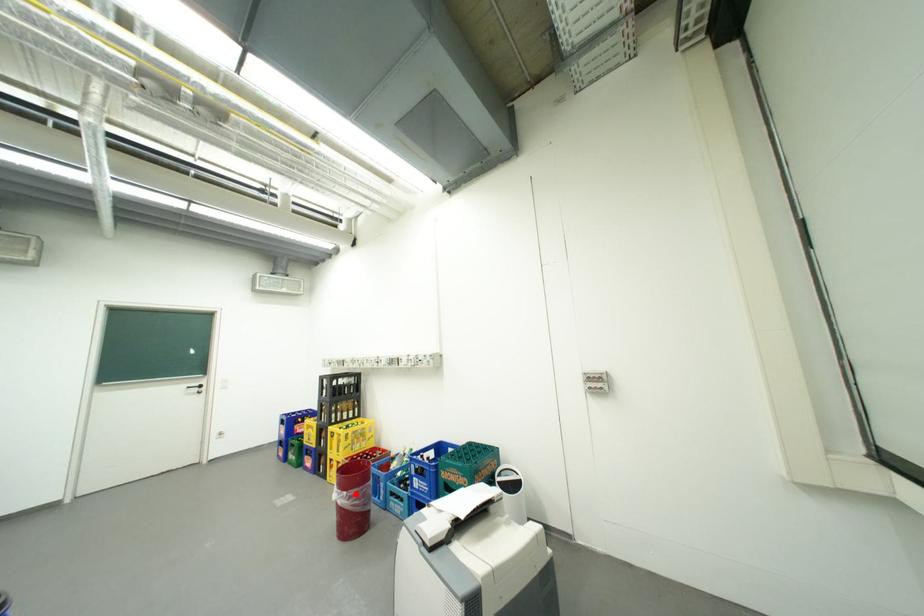
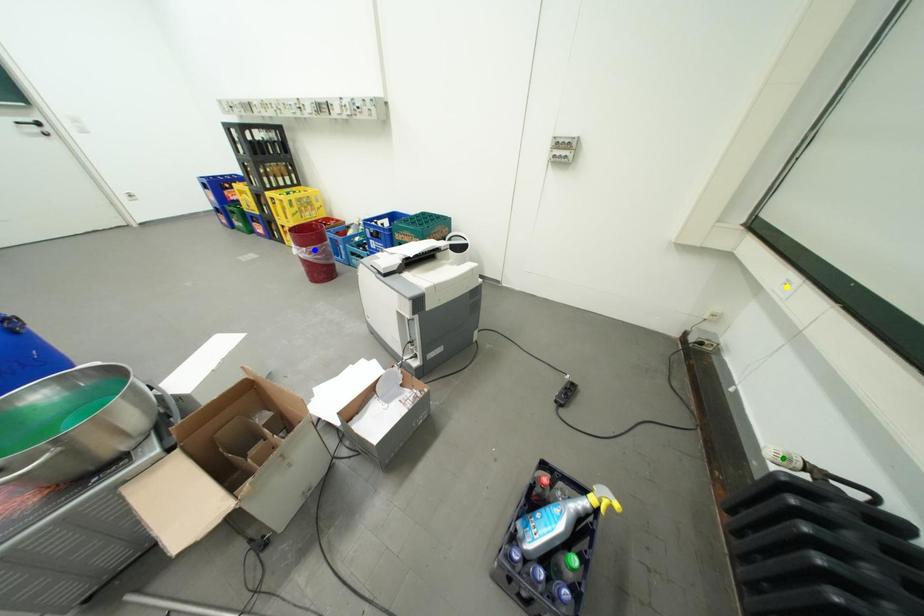
Question: I am providing you with two images of the same scene from different viewpoints. A red point is marked on the first image. You are given multiple points on the second image. Which mark in image 2 goes with the point in image 1?

Choices:
 (A) blue point
 (B) green point
 (C) yellow point

Answer: (A)